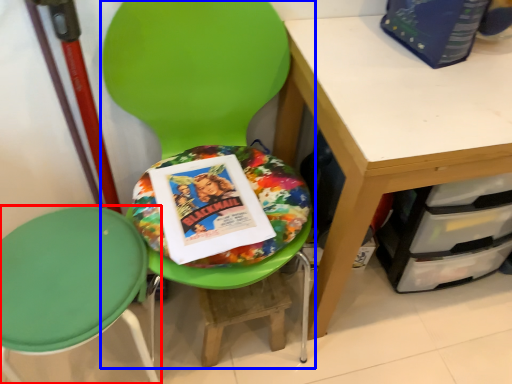
Question: Which point is closer to the camera, chair (highlighted by a red box) or chair (highlighted by a blue box)?

Choices:
 (A) chair
 (B) chair

Answer: (B)